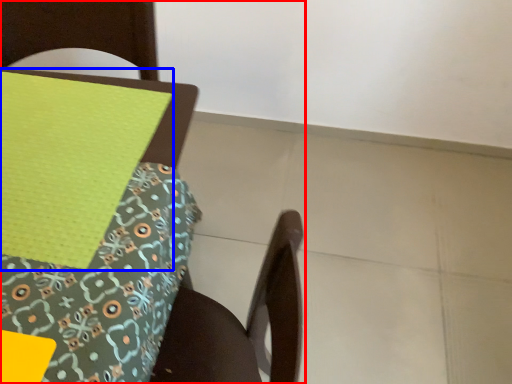
Question: Which point is closer to the camera, chair (highlighted by a red box) or sheet (highlighted by a blue box)?

Choices:
 (A) chair
 (B) sheet

Answer: (A)